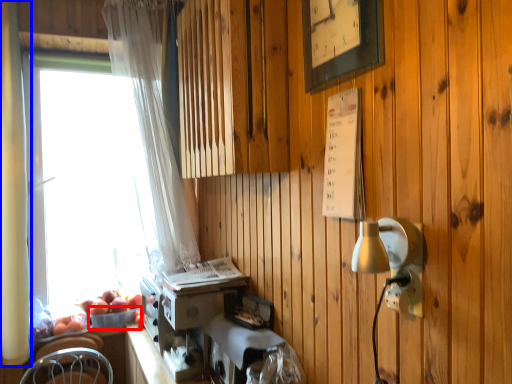
Question: Among these objects, which one is nearest to the camera, basket (highlighted by a red box) or curtain (highlighted by a blue box)?

Choices:
 (A) basket
 (B) curtain

Answer: (B)